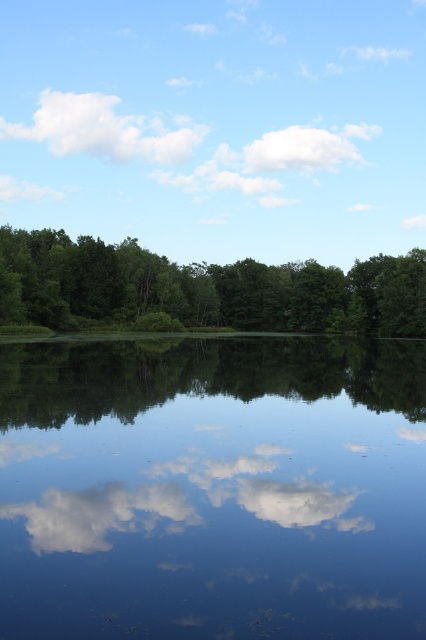
Question: Which object is the farthest from the transparent blue water at center?

Choices:
 (A) green leafy forest at center
 (B) white fluffy cloud at upper left

Answer: (B)

Question: Does green leafy forest at center have a lesser width compared to white fluffy cloud at upper left?

Choices:
 (A) yes
 (B) no

Answer: (A)

Question: Among these objects, which one is farthest from the camera?

Choices:
 (A) green leafy forest at center
 (B) white fluffy cloud at upper center
 (C) transparent blue water at center
 (D) white fluffy cloud at upper left

Answer: (D)

Question: Is green leafy forest at center below white fluffy cloud at upper center?

Choices:
 (A) yes
 (B) no

Answer: (A)

Question: Is transparent blue water at center behind green leafy forest at center?

Choices:
 (A) yes
 (B) no

Answer: (B)

Question: Based on their relative distances, which object is farther from the white fluffy cloud at upper center?

Choices:
 (A) transparent blue water at center
 (B) green leafy forest at center
 (C) white fluffy cloud at upper left

Answer: (A)